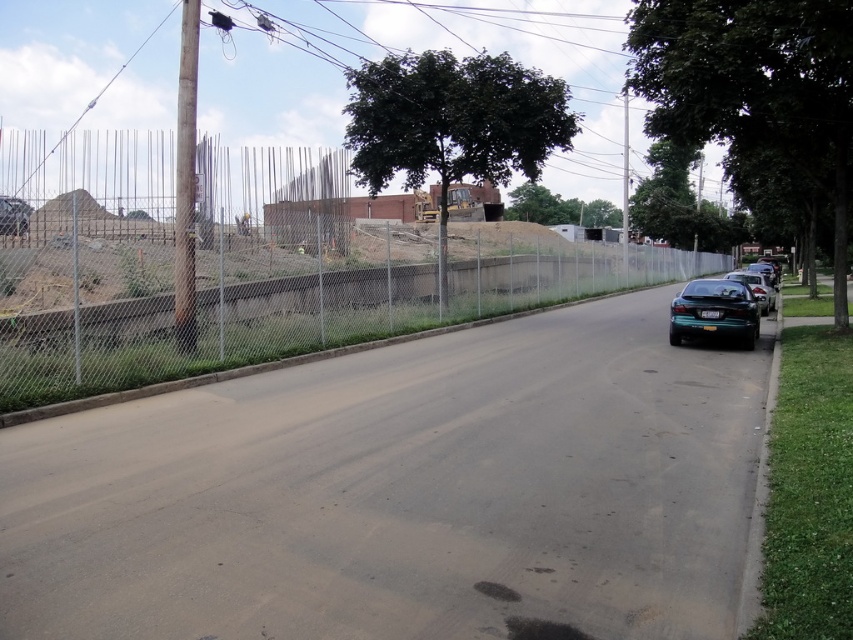
Question: Is green glossy sedan at right to the left of teal glossy sedan at right from the viewer's perspective?

Choices:
 (A) no
 (B) yes

Answer: (B)

Question: Observing the image, what is the correct spatial positioning of chain-link fence at center in reference to green matte car at right?

Choices:
 (A) below
 (B) above

Answer: (B)

Question: Which point is farther to the camera?

Choices:
 (A) gray asphalt road at center
 (B) green matte car at right

Answer: (B)

Question: Among these objects, which one is farthest from the camera?

Choices:
 (A) chain-link fence at center
 (B) teal glossy sedan at right

Answer: (B)

Question: Can you confirm if metallic wire at upper center is positioned to the right of green glossy sedan at right?

Choices:
 (A) no
 (B) yes

Answer: (B)

Question: Among these objects, which one is nearest to the camera?

Choices:
 (A) gray asphalt road at center
 (B) green glossy sedan at right

Answer: (A)